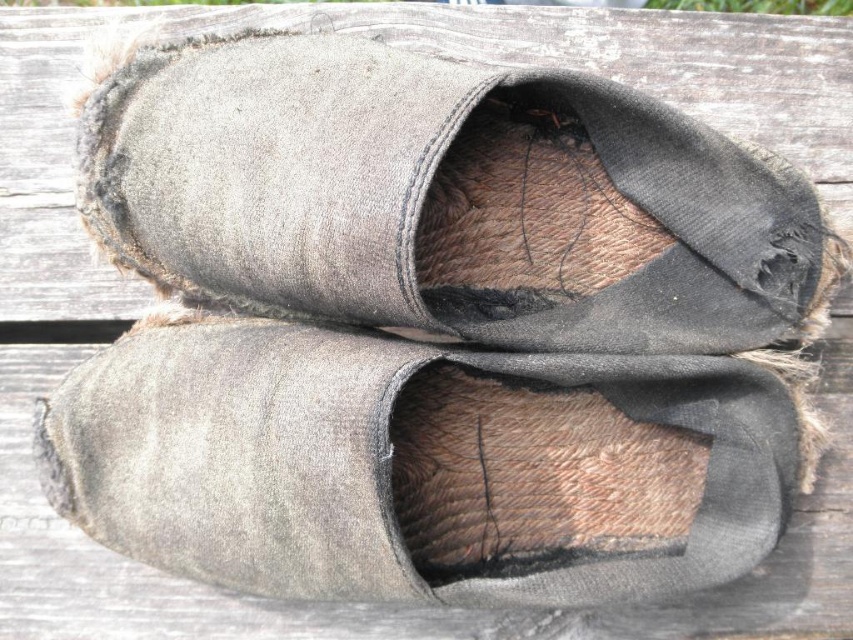
Question: Is fuzzy suede slipper at center thinner than gray suede shoe at center?

Choices:
 (A) yes
 (B) no

Answer: (A)

Question: Which point is closer to the camera?

Choices:
 (A) (788, 472)
 (B) (254, 108)

Answer: (B)

Question: Among these points, which one is farthest from the camera?

Choices:
 (A) (120, 518)
 (B) (306, 38)

Answer: (B)

Question: Can you confirm if fuzzy suede slipper at center is positioned to the left of gray suede shoe at center?

Choices:
 (A) no
 (B) yes

Answer: (A)

Question: Observing the image, what is the correct spatial positioning of fuzzy suede slipper at center in reference to gray suede shoe at center?

Choices:
 (A) left
 (B) right

Answer: (B)